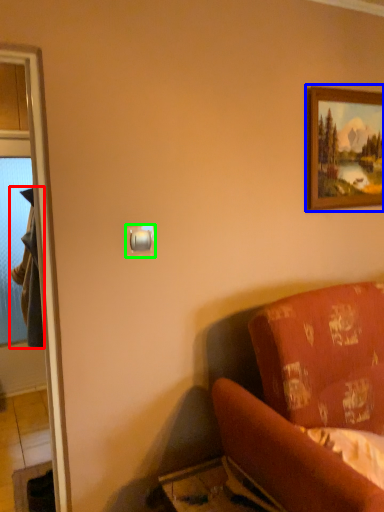
Question: Which object is positioned farthest from robe (highlighted by a red box)? Select from picture frame (highlighted by a blue box) and light switch (highlighted by a green box).

Choices:
 (A) picture frame
 (B) light switch

Answer: (A)